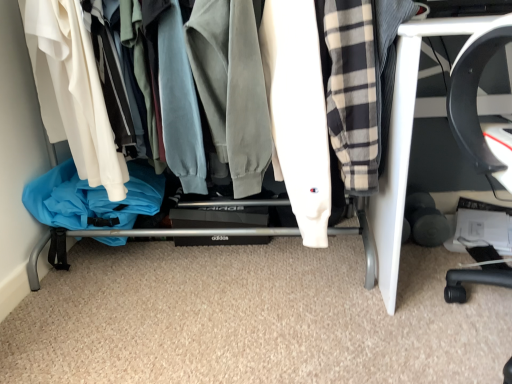
Where is `white plastic table at right`? This screenshot has width=512, height=384. white plastic table at right is located at coordinates (405, 144).

Describe the element at coordinates (405, 144) in the screenshot. I see `white plastic table at right` at that location.

I want to click on white plastic table at right, so click(x=405, y=144).